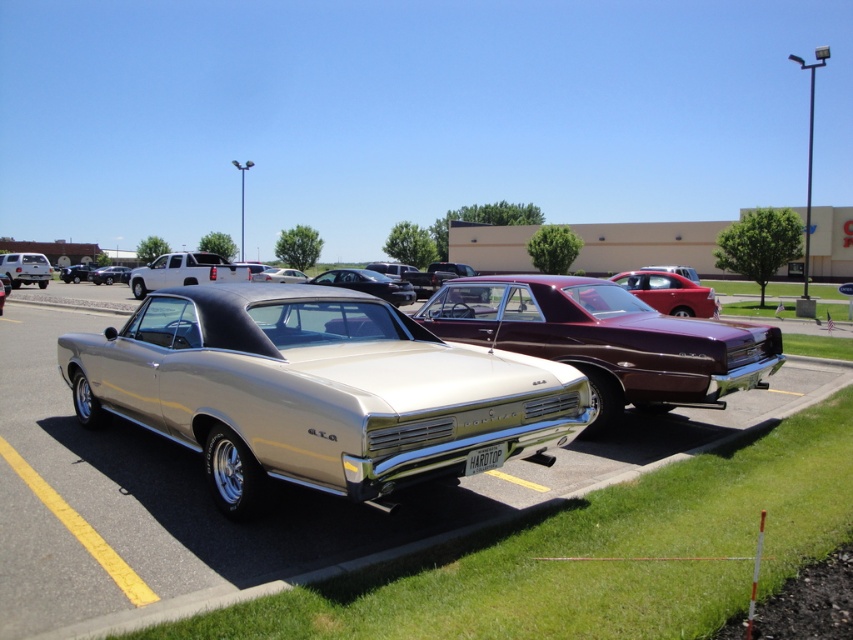
Question: Which point appears closest to the camera in this image?

Choices:
 (A) (221, 266)
 (B) (350, 285)

Answer: (B)

Question: Is shiny maroon car at center bigger than shiny gold car at center?

Choices:
 (A) yes
 (B) no

Answer: (B)

Question: Which point is farther to the camera?

Choices:
 (A) (328, 282)
 (B) (679, 282)
 (C) (83, 266)

Answer: (C)

Question: Is white glossy truck at upper left smaller than shiny gold car at center?

Choices:
 (A) no
 (B) yes

Answer: (B)

Question: Considering the real-world distances, which object is closest to the shiny black sedan at center?

Choices:
 (A) white glossy truck at upper left
 (B) shiny black car at center
 (C) shiny gold car at center

Answer: (C)

Question: Where is shiny black car at center located in relation to shiny silver sedan at center in the image?

Choices:
 (A) above
 (B) below

Answer: (B)